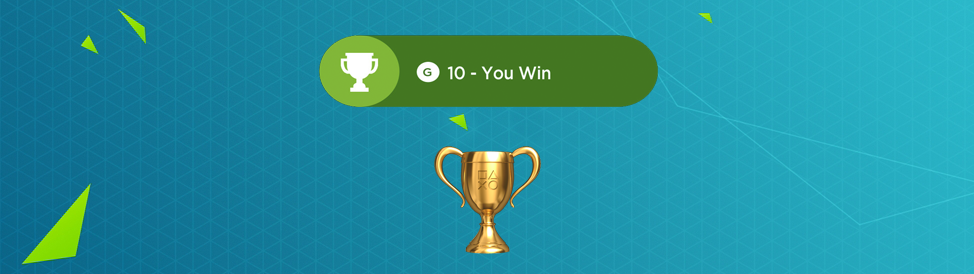
Identify the location of handle. (438, 154), (527, 149), (376, 64), (340, 65).